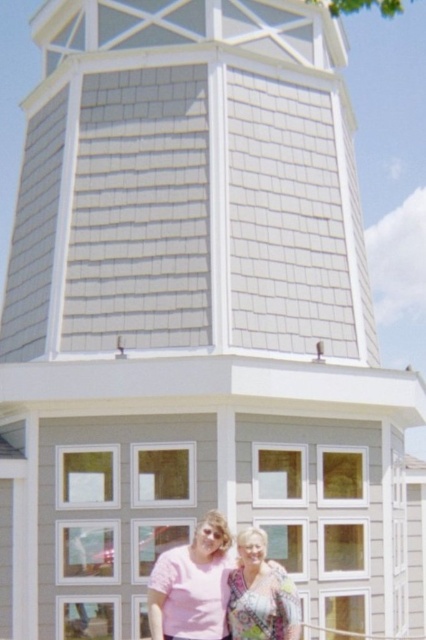
Question: Among these points, which one is farthest from the camera?

Choices:
 (A) (230, 625)
 (B) (190, 568)

Answer: (B)

Question: Does pink matte shirt at lower center appear over patterned fabric blouse at lower center?

Choices:
 (A) no
 (B) yes

Answer: (B)

Question: Which object is farther from the camera taking this photo?

Choices:
 (A) pink matte shirt at lower center
 (B) patterned fabric blouse at lower center

Answer: (A)

Question: Among these points, which one is nearest to the camera?

Choices:
 (A) (291, 625)
 (B) (184, 554)

Answer: (A)

Question: Does pink matte shirt at lower center have a larger size compared to patterned fabric blouse at lower center?

Choices:
 (A) no
 (B) yes

Answer: (B)

Question: Does pink matte shirt at lower center appear over patterned fabric blouse at lower center?

Choices:
 (A) no
 (B) yes

Answer: (B)